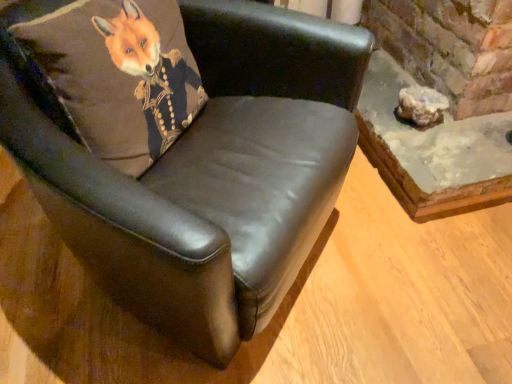
Measure the distance between black leather chair at upper left and camera.

black leather chair at upper left is 24.05 inches from camera.

At what (x,y) coordinates should I click in order to perform the action: click on brown leather pillow at upper left. Please return your answer as a coordinate pair (x, y). The height and width of the screenshot is (384, 512). Looking at the image, I should click on (101, 72).

The image size is (512, 384). What do you see at coordinates (432, 151) in the screenshot?
I see `rustic concrete table at lower right` at bounding box center [432, 151].

You are a GUI agent. You are given a task and a screenshot of the screen. Output one action in this format:
    pyautogui.click(x=<x>, y=<y>)
    Task: Click on the black leather chair at upper left
    This screenshot has width=512, height=384.
    Given the screenshot: What is the action you would take?
    pyautogui.click(x=206, y=173)

From the image's perspective, is black leather chair at upper left located beneath translucent white rock at lower right?

Yes, from the image's perspective, black leather chair at upper left is beneath translucent white rock at lower right.

Between black leather chair at upper left and translucent white rock at lower right, which one has larger width?

With larger width is black leather chair at upper left.

Is black leather chair at upper left taller than translucent white rock at lower right?

Yes.

The height and width of the screenshot is (384, 512). In order to click on stone on the right side of black leather chair at upper left in this screenshot , I will do `click(421, 106)`.

Based on the photo, is brown leather pillow at upper left facing away from black leather chair at upper left?

Yes, brown leather pillow at upper left's orientation is away from black leather chair at upper left.

Which of these two, brown leather pillow at upper left or black leather chair at upper left, is thinner?

brown leather pillow at upper left.

Between brown leather pillow at upper left and black leather chair at upper left, which one has less height?

brown leather pillow at upper left.

From a real-world perspective, is brown leather pillow at upper left located beneath black leather chair at upper left?

No.

Does point (435, 132) appear closer or farther from the camera than point (402, 90)?

Point (435, 132).

Considering the relative positions of rustic concrete table at lower right and translucent white rock at lower right in the image provided, is rustic concrete table at lower right to the right of translucent white rock at lower right from the viewer's perspective?

Correct, you'll find rustic concrete table at lower right to the right of translucent white rock at lower right.

From the image's perspective, between rustic concrete table at lower right and translucent white rock at lower right, who is located below?

translucent white rock at lower right is shown below in the image.

Which object is closer to the camera taking this photo, rustic concrete table at lower right or translucent white rock at lower right?

rustic concrete table at lower right.

Where is `stone beneath the brown leather pillow at upper left (from a real-world perspective)`? This screenshot has height=384, width=512. stone beneath the brown leather pillow at upper left (from a real-world perspective) is located at coordinates (421, 106).

Considering the positions of objects translucent white rock at lower right and brown leather pillow at upper left in the image provided, who is more to the right, translucent white rock at lower right or brown leather pillow at upper left?

translucent white rock at lower right.

Is translucent white rock at lower right wider than brown leather pillow at upper left?

No, translucent white rock at lower right is not wider than brown leather pillow at upper left.

Locate an element on the screen. The height and width of the screenshot is (384, 512). pillow below the rustic concrete table at lower right (from the image's perspective) is located at coordinates (101, 72).

Is brown leather pillow at upper left looking in the opposite direction of rustic concrete table at lower right?

brown leather pillow at upper left does not have its back to rustic concrete table at lower right.

From the picture: Is brown leather pillow at upper left touching rustic concrete table at lower right?

No, brown leather pillow at upper left is not next to rustic concrete table at lower right.

Which is less distant, (422, 221) or (195, 314)?

The point (195, 314) is in front.

Measure the distance between rustic concrete table at lower right and black leather chair at upper left.

rustic concrete table at lower right is 24.66 inches away from black leather chair at upper left.

How many degrees apart are the facing directions of rustic concrete table at lower right and black leather chair at upper left?

The angle between the facing direction of rustic concrete table at lower right and the facing direction of black leather chair at upper left is 47.8 degrees.

Is rustic concrete table at lower right further to the viewer compared to black leather chair at upper left?

Yes, rustic concrete table at lower right is behind black leather chair at upper left.

From a real-world perspective, is black leather chair at upper left positioned above or below rustic concrete table at lower right?

In terms of real-world spatial position, black leather chair at upper left is above rustic concrete table at lower right.

Is black leather chair at upper left situated inside rustic concrete table at lower right or outside?

black leather chair at upper left is not inside rustic concrete table at lower right, it's outside.

Between black leather chair at upper left and rustic concrete table at lower right, which one has smaller size?

Smaller between the two is rustic concrete table at lower right.

Is point (150, 200) farther from viewer compared to point (435, 152)?

No, (150, 200) is in front of (435, 152).

Where is `chair in front of the translucent white rock at lower right`? chair in front of the translucent white rock at lower right is located at coordinates (206, 173).

At what (x,y) coordinates should I click in order to perform the action: click on pillow above the black leather chair at upper left (from the image's perspective). Please return your answer as a coordinate pair (x, y). The width and height of the screenshot is (512, 384). Looking at the image, I should click on (101, 72).

Based on their spatial positions, is rustic concrete table at lower right or black leather chair at upper left further from translucent white rock at lower right?

Among the two, black leather chair at upper left is located further to translucent white rock at lower right.

Considering their positions, is rustic concrete table at lower right positioned further to brown leather pillow at upper left than black leather chair at upper left?

rustic concrete table at lower right is further to brown leather pillow at upper left.

When comparing their distances from brown leather pillow at upper left, does rustic concrete table at lower right or translucent white rock at lower right seem further?

translucent white rock at lower right.

Which object lies further to the anchor point translucent white rock at lower right, black leather chair at upper left or rustic concrete table at lower right?

Based on the image, black leather chair at upper left appears to be further to translucent white rock at lower right.

Considering their positions, is black leather chair at upper left positioned further to brown leather pillow at upper left than rustic concrete table at lower right?

Based on the image, rustic concrete table at lower right appears to be further to brown leather pillow at upper left.

Based on their spatial positions, is rustic concrete table at lower right or brown leather pillow at upper left closer to translucent white rock at lower right?

rustic concrete table at lower right lies closer to translucent white rock at lower right than the other object.

Which object lies further to the anchor point rustic concrete table at lower right, black leather chair at upper left or brown leather pillow at upper left?

Based on the image, brown leather pillow at upper left appears to be further to rustic concrete table at lower right.

Based on their spatial positions, is brown leather pillow at upper left or translucent white rock at lower right further from rustic concrete table at lower right?

The object further to rustic concrete table at lower right is brown leather pillow at upper left.

You are a GUI agent. You are given a task and a screenshot of the screen. Output one action in this format:
    pyautogui.click(x=<x>, y=<y>)
    Task: Click on the stone between brown leather pillow at upper left and rustic concrete table at lower right
    
    Given the screenshot: What is the action you would take?
    pyautogui.click(x=421, y=106)

Locate an element on the screen. chair between brown leather pillow at upper left and translucent white rock at lower right from left to right is located at coordinates (206, 173).

Locate an element on the screen. stone between black leather chair at upper left and rustic concrete table at lower right is located at coordinates [421, 106].

You are a GUI agent. You are given a task and a screenshot of the screen. Output one action in this format:
    pyautogui.click(x=<x>, y=<y>)
    Task: Click on the chair situated between brown leather pillow at upper left and rustic concrete table at lower right from left to right
    
    Given the screenshot: What is the action you would take?
    pyautogui.click(x=206, y=173)